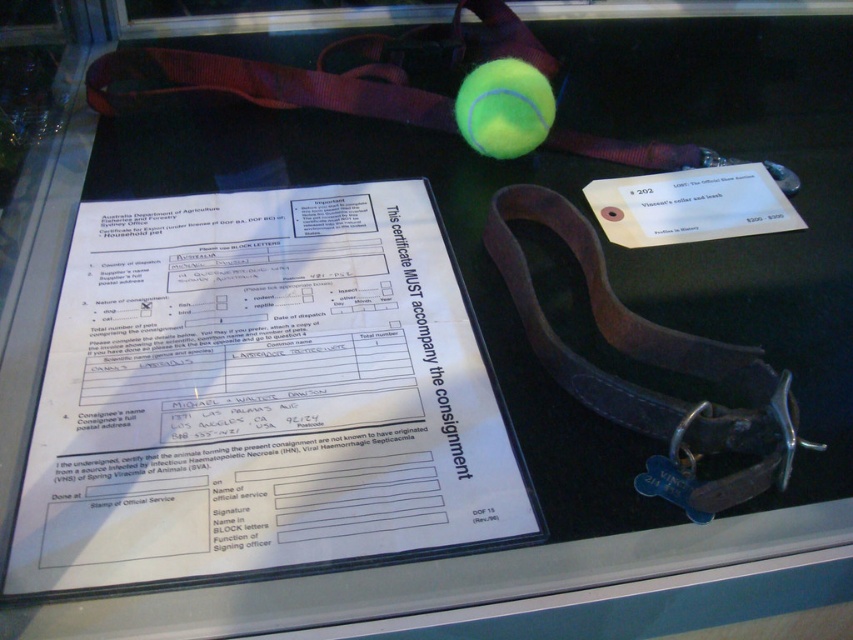
Question: Is brown leather collar at center thinner than green rubber tennis ball at upper center?

Choices:
 (A) no
 (B) yes

Answer: (A)

Question: Is brown leather collar at center further to camera compared to green rubber tennis ball at upper center?

Choices:
 (A) no
 (B) yes

Answer: (A)

Question: Which point is closer to the camera taking this photo?

Choices:
 (A) (498, 61)
 (B) (631, 429)

Answer: (B)

Question: From the image, what is the correct spatial relationship of brown leather collar at center in relation to green rubber tennis ball at upper center?

Choices:
 (A) right
 (B) left

Answer: (A)